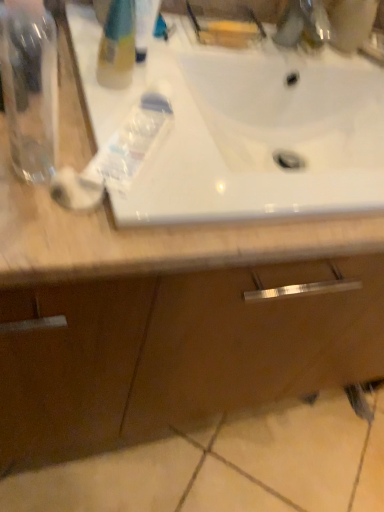
Identify the location of vacant space situated on the left part of translucent plastic toothpaste at center. (52, 117).